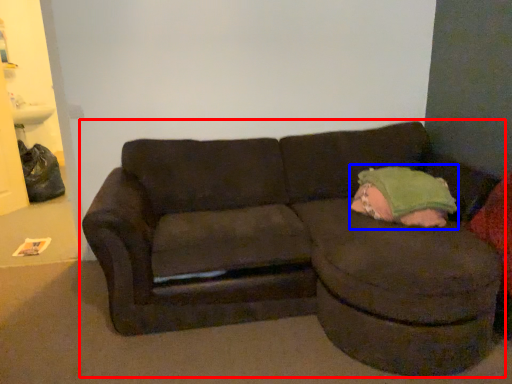
Question: Which object appears closest to the camera in this image, studio couch (highlighted by a red box) or toddler (highlighted by a blue box)?

Choices:
 (A) studio couch
 (B) toddler

Answer: (A)